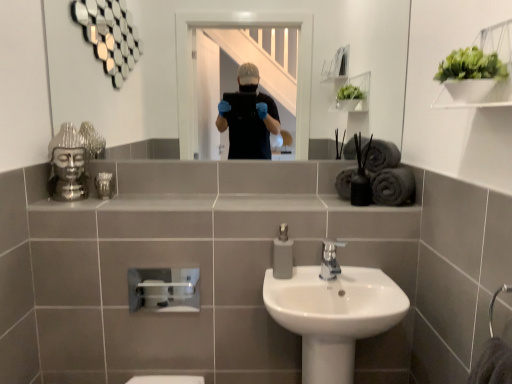
This screenshot has height=384, width=512. Identify the location of free point in front of metallic glass at upper left. (99, 196).